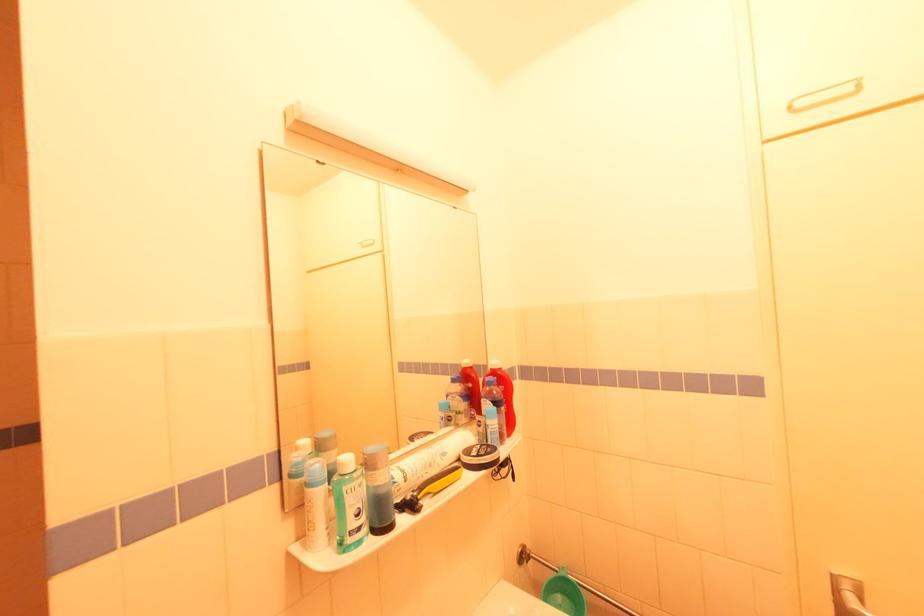
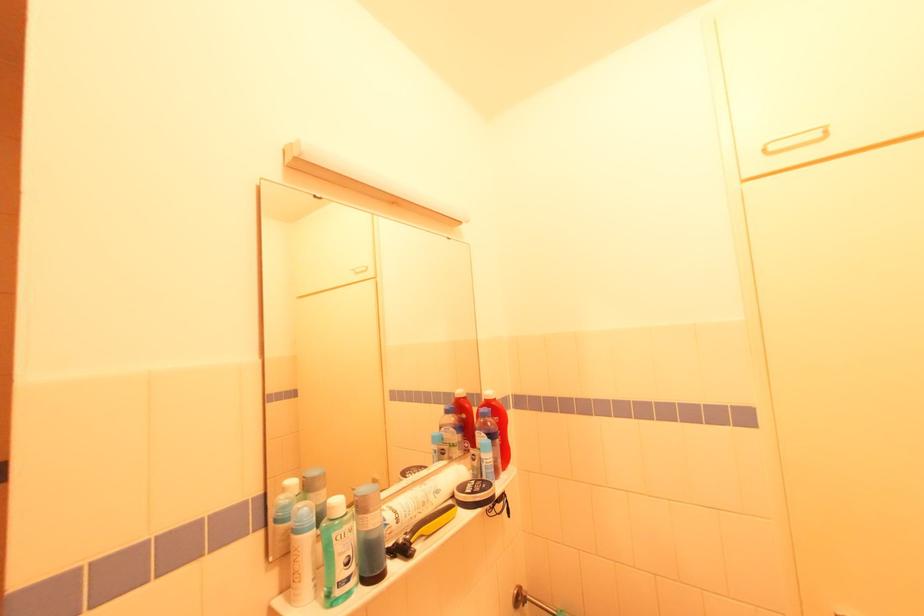
The point at (x=412, y=507) is marked in the first image. Where is the corresponding point in the second image?

(406, 552)